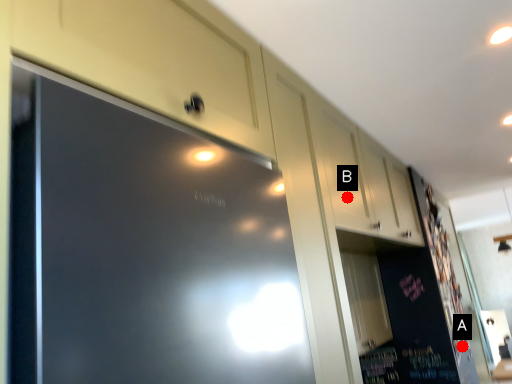
Question: Two points are circled on the image, labeled by A and B beside each circle. Which point is closer to the camera?

Choices:
 (A) A is closer
 (B) B is closer

Answer: (B)